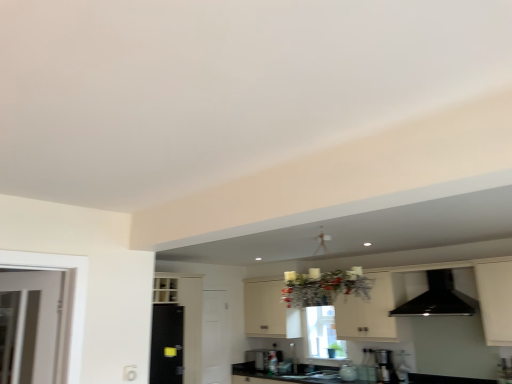
Question: Does point (450, 276) appear closer or farther from the camera than point (508, 264)?

Choices:
 (A) closer
 (B) farther

Answer: (B)

Question: From the image's perspective, relative to white matte cabinet at center, is black glossy exhaust hood at upper right above or below?

Choices:
 (A) below
 (B) above

Answer: (B)

Question: Which object is positioned farthest from the white matte door at center?

Choices:
 (A) white matte cabinet at center
 (B) black granite countertop at lower center
 (C) black glossy exhaust hood at upper right
 (D) satin silver coffee machine at lower right
 (E) black glossy sink at center, positioned as the first sink in top-to-bottom order

Answer: (C)

Question: Based on their relative distances, which object is farther from the black glossy sink at center, acting as the second sink starting from the bottom?

Choices:
 (A) white matte door at center
 (B) satin silver coffee machine at lower right
 (C) black granite countertop at lower center
 (D) metallic silver toaster at center
 (E) black glossy sink at center, which is the second sink from top to bottom

Answer: (A)